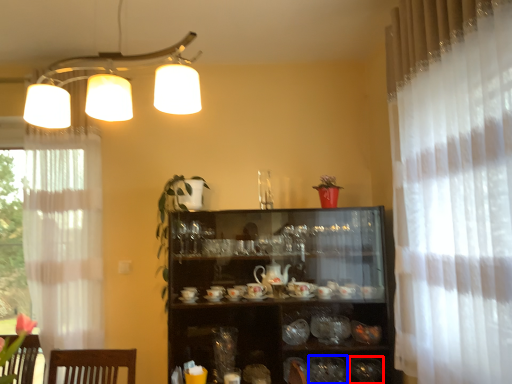
Question: Which of the following is the farthest to the observer, tableware (highlighted by a red box) or tableware (highlighted by a blue box)?

Choices:
 (A) tableware
 (B) tableware

Answer: (A)